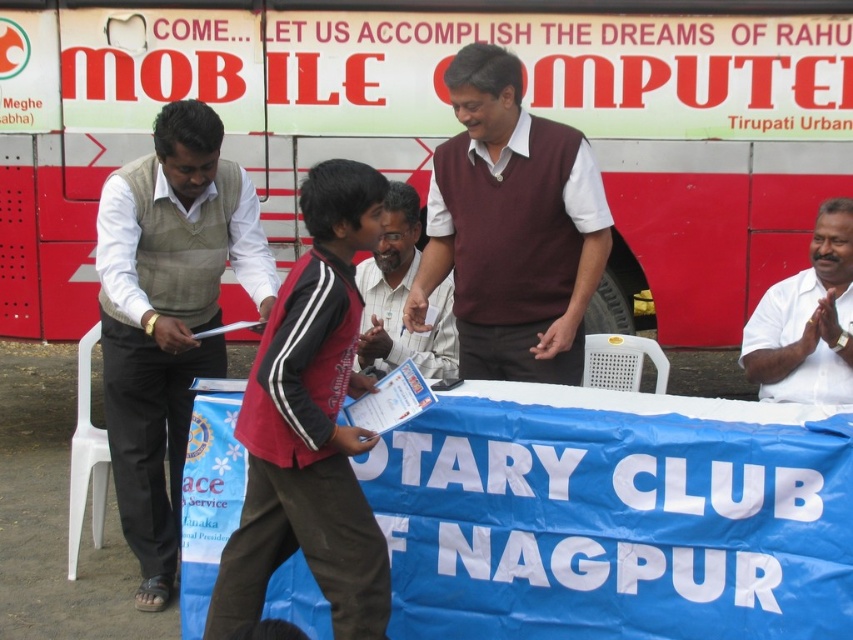
Does maroon sweater at center have a lesser height compared to white matte shirt at center?

No, maroon sweater at center is not shorter than white matte shirt at center.

Does maroon sweater at center lie in front of white matte shirt at center?

That is True.

Is point (605, 214) positioned before point (408, 268)?

Yes, point (605, 214) is in front of point (408, 268).

The image size is (853, 640). Find the location of `maroon sweater at center`. maroon sweater at center is located at coordinates (511, 228).

Who is more forward, (306, 506) or (813, 333)?

Point (306, 506) is more forward.

Does dark red jacket at center have a lesser height compared to white matte shirt at right?

No.

Where is `dark red jacket at center`? dark red jacket at center is located at coordinates (310, 426).

This screenshot has height=640, width=853. I want to click on dark red jacket at center, so click(310, 426).

Is white matte shirt at right further to camera compared to white matte shirt at center?

No, it is in front of white matte shirt at center.

Can you confirm if white matte shirt at right is wider than white matte shirt at center?

Incorrect, white matte shirt at right's width does not surpass white matte shirt at center's.

Does point (775, 388) come behind point (444, 358)?

No, (775, 388) is closer to viewer.

You are a GUI agent. You are given a task and a screenshot of the screen. Output one action in this format:
    pyautogui.click(x=<x>, y=<y>)
    Task: Click on the white matte shirt at right
    The width and height of the screenshot is (853, 640).
    Given the screenshot: What is the action you would take?
    pyautogui.click(x=807, y=321)